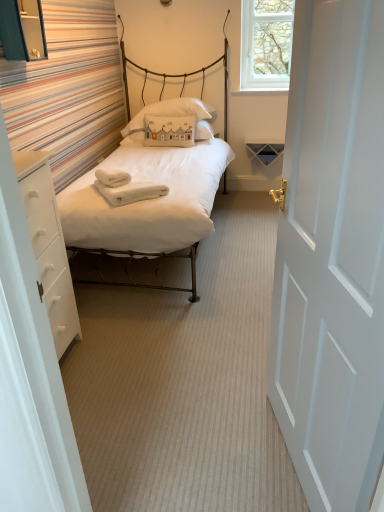
Question: Does matte white bed at center have a greater height compared to white painted wood door at right?

Choices:
 (A) no
 (B) yes

Answer: (B)

Question: Is the position of matte white bed at center less distant than that of white painted wood door at right?

Choices:
 (A) no
 (B) yes

Answer: (A)

Question: Can you confirm if matte white bed at center is positioned to the right of white painted wood door at right?

Choices:
 (A) yes
 (B) no

Answer: (B)

Question: Considering the relative sizes of matte white bed at center and white painted wood door at right in the image provided, is matte white bed at center smaller than white painted wood door at right?

Choices:
 (A) yes
 (B) no

Answer: (B)

Question: Is matte white bed at center bigger than white painted wood door at right?

Choices:
 (A) no
 (B) yes

Answer: (B)

Question: Would you say clear glass window at upper right is inside or outside white matte drawer at left?

Choices:
 (A) inside
 (B) outside

Answer: (B)

Question: Looking at the image, does clear glass window at upper right seem bigger or smaller compared to white matte drawer at left?

Choices:
 (A) big
 (B) small

Answer: (B)

Question: In terms of width, does clear glass window at upper right look wider or thinner when compared to white matte drawer at left?

Choices:
 (A) thin
 (B) wide

Answer: (A)

Question: Is point (259, 20) closer or farther from the camera than point (61, 250)?

Choices:
 (A) closer
 (B) farther

Answer: (B)

Question: Looking at their shapes, would you say white fabric pillow at center is wider or thinner than white soft towel at center?

Choices:
 (A) thin
 (B) wide

Answer: (B)

Question: Which is correct: white fabric pillow at center is inside white soft towel at center, or outside of it?

Choices:
 (A) outside
 (B) inside

Answer: (A)

Question: Considering the positions of white fabric pillow at center and white soft towel at center in the image, is white fabric pillow at center taller or shorter than white soft towel at center?

Choices:
 (A) tall
 (B) short

Answer: (A)

Question: From the image's perspective, is white fabric pillow at center above or below white soft towel at center?

Choices:
 (A) below
 (B) above

Answer: (B)

Question: Does point (109, 173) appear closer or farther from the camera than point (107, 168)?

Choices:
 (A) closer
 (B) farther

Answer: (A)

Question: In the image, is white soft towel at center positioned in front of or behind white soft towels at center?

Choices:
 (A) behind
 (B) front

Answer: (B)